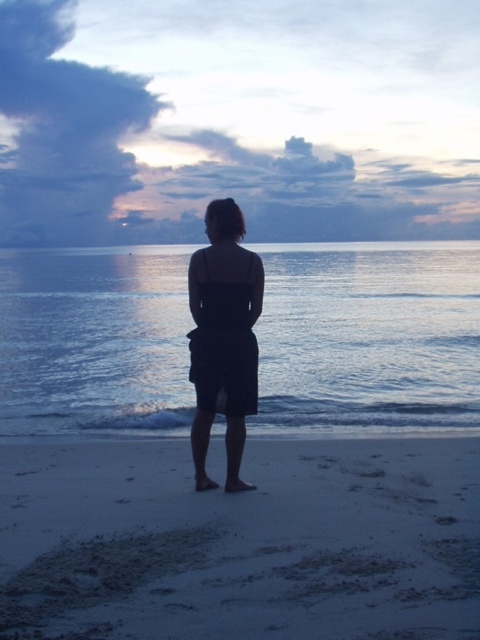
You are standing on the white sandy beach at lower center and want to walk towards the glistening blue water at center. In which direction should you head?

You should head to the left because the white sandy beach at lower center is to the right of the glistening blue water at center, so moving left will take you toward the water.

You are a photographer planning to take a silhouette photo of the black matte dress at center against the white sandy beach at lower center. Based on the scene description, where should you position the dress relative to the beach to achieve the best silhouette effect?

The white sandy beach at lower center is below the black matte dress at center, so positioning the dress above the beach will create a clear contrast between the dark dress and the bright beach, enhancing the silhouette effect.

You are planning to take a photo of the black matte dress at center while standing on the white sandy beach at lower center. Since the beach is wider than the dress, where should you position yourself to ensure the dress is fully visible in the frame without any part being cut off?

Position yourself towards the edge of the white sandy beach at lower center so that the black matte dress at center fits entirely within the frame, as the beach is wider than the dress.